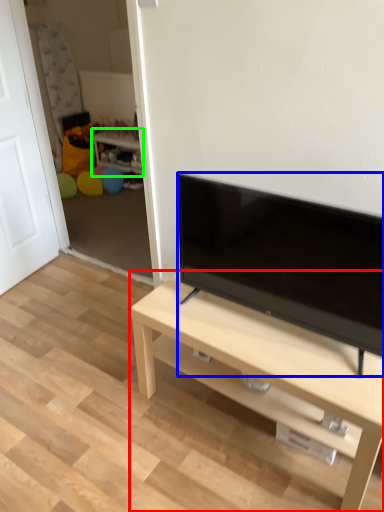
Question: Estimate the real-world distances between objects in this image. Which object is closer to desk (highlighted by a red box), television (highlighted by a blue box) or side table (highlighted by a green box)?

Choices:
 (A) television
 (B) side table

Answer: (A)